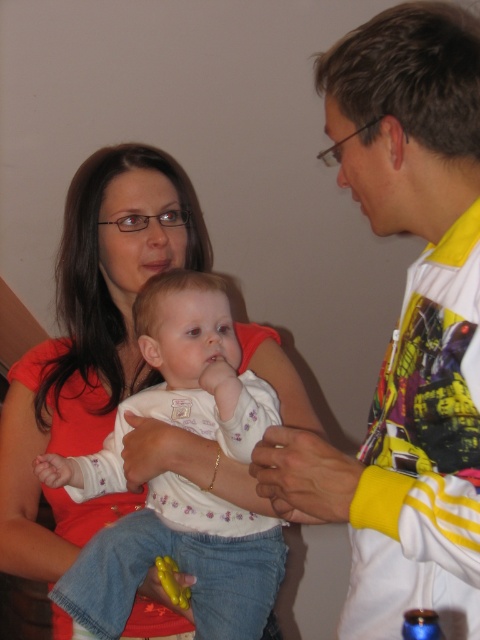
Consider the image. You are a robot trying to locate two specific points in the image. The first point is labeled as point (466, 330) and the second is point (127, 627). Based on their positions, which point is closer to the viewer?

Point (466, 330) is in front of point (127, 627), so it is closer to the viewer.